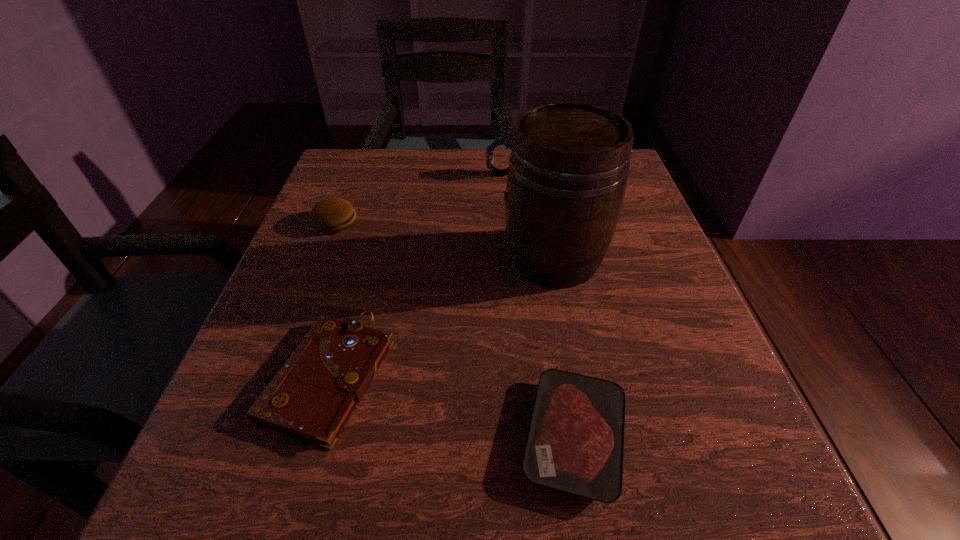
Where is `free area in between the steak and the patty`? The image size is (960, 540). free area in between the steak and the patty is located at coordinates (455, 329).

The height and width of the screenshot is (540, 960). In order to click on free space that is in between the fourth tallest object and the patty in this screenshot , I will do `click(332, 299)`.

Find the location of `free spot between the notebook and the watch`. free spot between the notebook and the watch is located at coordinates (416, 274).

Where is `object that ranks as the second closest to the shortest object`? This screenshot has height=540, width=960. object that ranks as the second closest to the shortest object is located at coordinates (313, 395).

Locate which object is the closest to the fourth shortest object. Please provide its 2D coordinates. Your answer should be formatted as a tuple, i.e. [(x, y)], where the tuple contains the x and y coordinates of a point satisfying the conditions above.

[(569, 164)]

Identify the location of vacant space that satisfies the following two spatial constraints: 1. on the face of the steak; 2. on the right side of the second tallest object. (518, 436).

The width and height of the screenshot is (960, 540). Identify the location of vacant space that satisfies the following two spatial constraints: 1. on the back side of the shortest object; 2. on the face of the farthest object. (532, 174).

Where is `free space in the image that satisfies the following two spatial constraints: 1. on the face of the steak; 2. on the right side of the fourth shortest object`? free space in the image that satisfies the following two spatial constraints: 1. on the face of the steak; 2. on the right side of the fourth shortest object is located at coordinates (518, 436).